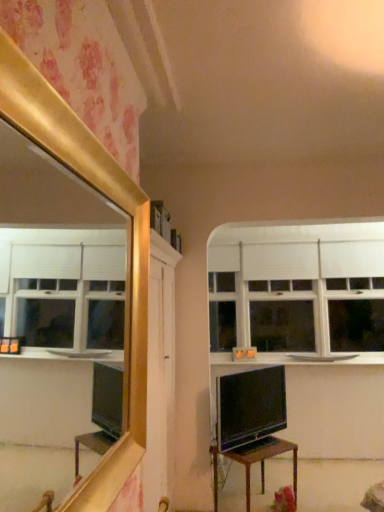
Question: From a real-world perspective, is matte black tv at center located higher than white matte window at upper center?

Choices:
 (A) yes
 (B) no

Answer: (B)

Question: Does matte black tv at center appear on the right side of white matte window at upper center?

Choices:
 (A) yes
 (B) no

Answer: (B)

Question: Is matte black tv at center surrounding white matte window at upper center?

Choices:
 (A) no
 (B) yes

Answer: (A)

Question: Is matte black tv at center facing away from white matte window at upper center?

Choices:
 (A) yes
 (B) no

Answer: (B)

Question: Considering the relative sizes of matte black tv at center and white matte window at upper center in the image provided, is matte black tv at center wider than white matte window at upper center?

Choices:
 (A) no
 (B) yes

Answer: (A)

Question: Considering the relative positions of white matte window at upper center and wooden table at center in the image provided, is white matte window at upper center to the left or to the right of wooden table at center?

Choices:
 (A) right
 (B) left

Answer: (A)

Question: In terms of size, does white matte window at upper center appear bigger or smaller than wooden table at center?

Choices:
 (A) small
 (B) big

Answer: (B)

Question: In terms of width, does white matte window at upper center look wider or thinner when compared to wooden table at center?

Choices:
 (A) thin
 (B) wide

Answer: (A)

Question: Is white matte window at upper center spatially inside wooden table at center, or outside of it?

Choices:
 (A) outside
 (B) inside

Answer: (A)

Question: Considering their positions, is white matte window at upper center located in front of or behind white glossy counter top at upper right?

Choices:
 (A) front
 (B) behind

Answer: (B)

Question: From a real-world perspective, relative to white glossy counter top at upper right, is white matte window at upper center vertically above or below?

Choices:
 (A) above
 (B) below

Answer: (A)

Question: From the image's perspective, relative to white glossy counter top at upper right, is white matte window at upper center above or below?

Choices:
 (A) above
 (B) below

Answer: (A)

Question: Is white matte window at upper center spatially inside white glossy counter top at upper right, or outside of it?

Choices:
 (A) outside
 (B) inside

Answer: (A)

Question: Would you say matte black tv at center is inside or outside white glossy counter top at upper right?

Choices:
 (A) inside
 (B) outside

Answer: (B)

Question: Is matte black tv at center taller or shorter than white glossy counter top at upper right?

Choices:
 (A) short
 (B) tall

Answer: (B)